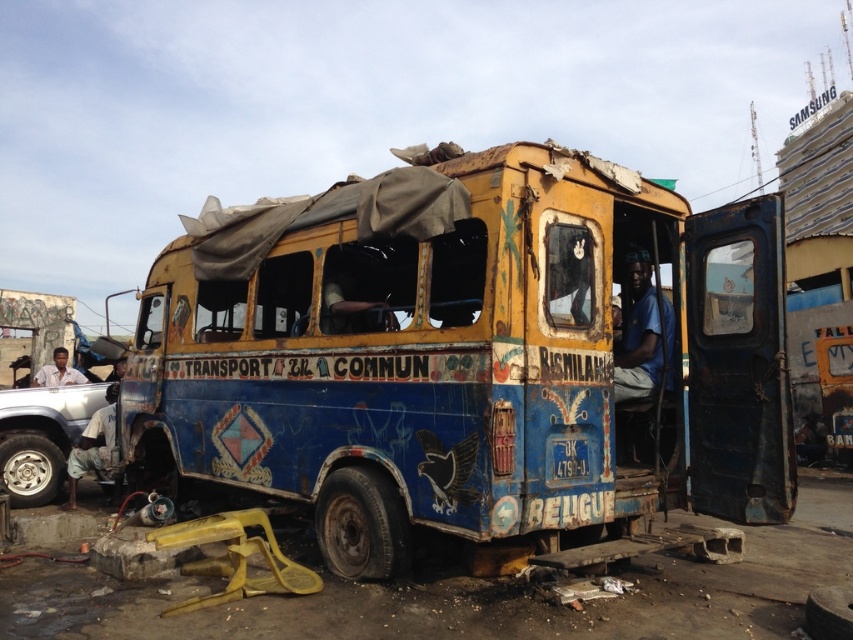
Question: Is rusty metal bus at center above silver metallic car at lower left?

Choices:
 (A) yes
 (B) no

Answer: (A)

Question: Which point appears closest to the camera in this image?

Choices:
 (A) (744, 461)
 (B) (19, 392)

Answer: (A)

Question: Can you confirm if rusty metal bus at center is bigger than silver metallic car at lower left?

Choices:
 (A) yes
 (B) no

Answer: (B)

Question: Can you confirm if rusty metal bus at center is wider than silver metallic car at lower left?

Choices:
 (A) no
 (B) yes

Answer: (A)

Question: Which point is farther from the camera taking this photo?

Choices:
 (A) (432, 412)
 (B) (3, 424)

Answer: (B)

Question: Which object appears closest to the camera in this image?

Choices:
 (A) rusty metal bus at center
 (B) silver metallic car at lower left

Answer: (A)